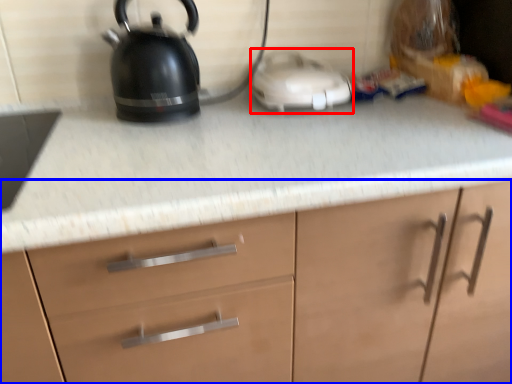
Question: Which object appears farthest to the camera in this image, appliance (highlighted by a red box) or cabinetry (highlighted by a blue box)?

Choices:
 (A) appliance
 (B) cabinetry

Answer: (A)